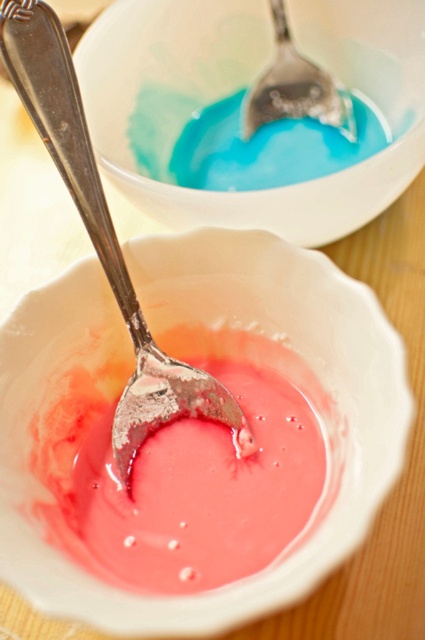
Question: Among these points, which one is farthest from the camera?

Choices:
 (A) (119, 616)
 (B) (331, 221)
 (C) (251, 436)
 (D) (297, 58)

Answer: (D)

Question: Is matte pink bowl at center thinner than polished silver spoon at center?

Choices:
 (A) yes
 (B) no

Answer: (B)

Question: Observing the image, what is the correct spatial positioning of matte pink bowl at center in reference to polished silver spoon at center?

Choices:
 (A) right
 (B) left

Answer: (A)

Question: Which of the following is the closest to the observer?

Choices:
 (A) matte white bowl at upper center
 (B) polished silver spoon at center

Answer: (B)

Question: Which object is closer to the camera taking this photo?

Choices:
 (A) matte pink bowl at center
 (B) matte white bowl at upper center
 (C) silver metallic spoon at upper center

Answer: (A)

Question: Does matte white bowl at upper center have a lesser width compared to silver metallic spoon at upper center?

Choices:
 (A) no
 (B) yes

Answer: (A)